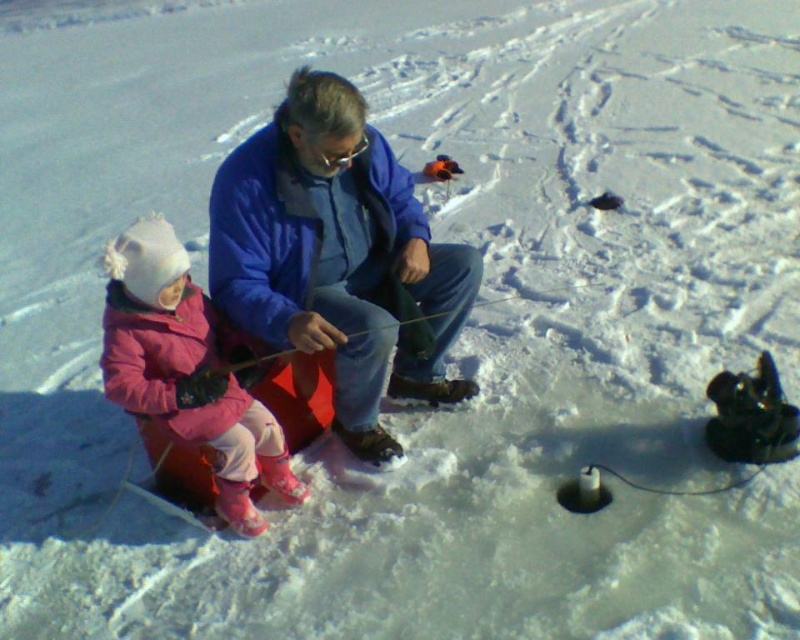
Question: Where is blue fabric jacket at center located in relation to pink fleece jacket at left in the image?

Choices:
 (A) right
 (B) left

Answer: (A)

Question: Considering the relative positions of blue fabric jacket at center and pink fleece jacket at left in the image provided, where is blue fabric jacket at center located with respect to pink fleece jacket at left?

Choices:
 (A) right
 (B) left

Answer: (A)

Question: Which object is closer to the camera taking this photo?

Choices:
 (A) pink fleece jacket at left
 (B) blue fabric jacket at center

Answer: (A)

Question: Is blue fabric jacket at center to the right of pink fleece jacket at left from the viewer's perspective?

Choices:
 (A) yes
 (B) no

Answer: (A)